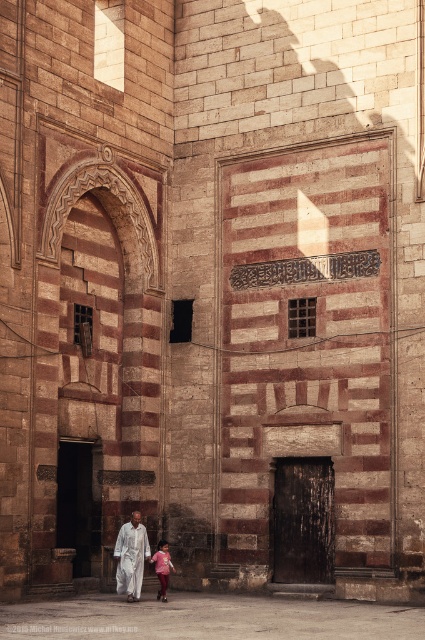
Is white cotton robe at center positioned in front of pink fabric dress at lower center?

That is False.

Does white cotton robe at center appear over pink fabric dress at lower center?

Yes, white cotton robe at center is above pink fabric dress at lower center.

Locate an element on the screen. Image resolution: width=425 pixels, height=640 pixels. white cotton robe at center is located at coordinates (130, 556).

Does white matte robe at center have a greater width compared to pink fabric dress at lower center?

Incorrect, white matte robe at center's width does not surpass pink fabric dress at lower center's.

Is white matte robe at center positioned in front of pink fabric dress at lower center?

Yes, white matte robe at center is closer to the viewer.

Image resolution: width=425 pixels, height=640 pixels. Describe the element at coordinates (130, 557) in the screenshot. I see `white matte robe at center` at that location.

Where is `white matte robe at center`? white matte robe at center is located at coordinates (130, 557).

Does white cotton robe at center have a lesser height compared to white matte robe at center?

Correct, white cotton robe at center is not as tall as white matte robe at center.

Between white cotton robe at center and white matte robe at center, which one has more height?

Standing taller between the two is white matte robe at center.

Identify the location of white cotton robe at center. (130, 556).